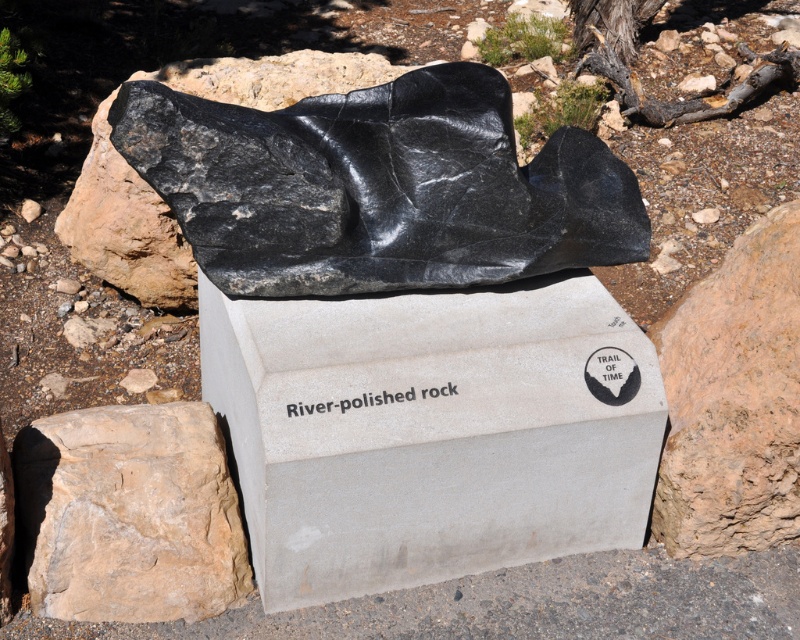
Which of these two, gray concrete plaque at center or black polished rock at center, stands taller?

gray concrete plaque at center

In the scene shown: Which is above, gray concrete plaque at center or black polished rock at center?

Positioned higher is black polished rock at center.

What are the coordinates of `gray concrete plaque at center` in the screenshot? It's located at (432, 433).

Which is in front, point (528, 252) or point (362, 401)?

Point (362, 401) is more forward.

Identify the location of black polished rock at center. click(377, 188).

Is point (294, 280) farther from camera compared to point (306, 408)?

Yes.

This screenshot has width=800, height=640. In order to click on black polished rock at center in this screenshot , I will do `click(377, 188)`.

Does beige rough rock at lower left have a larger size compared to brown rough rock at lower right?

Actually, beige rough rock at lower left might be smaller than brown rough rock at lower right.

Does beige rough rock at lower left have a smaller size compared to brown rough rock at lower right?

Correct, beige rough rock at lower left occupies less space than brown rough rock at lower right.

At what (x,y) coordinates should I click in order to perform the action: click on beige rough rock at lower left. Please return your answer as a coordinate pair (x, y). The width and height of the screenshot is (800, 640). Looking at the image, I should click on (130, 515).